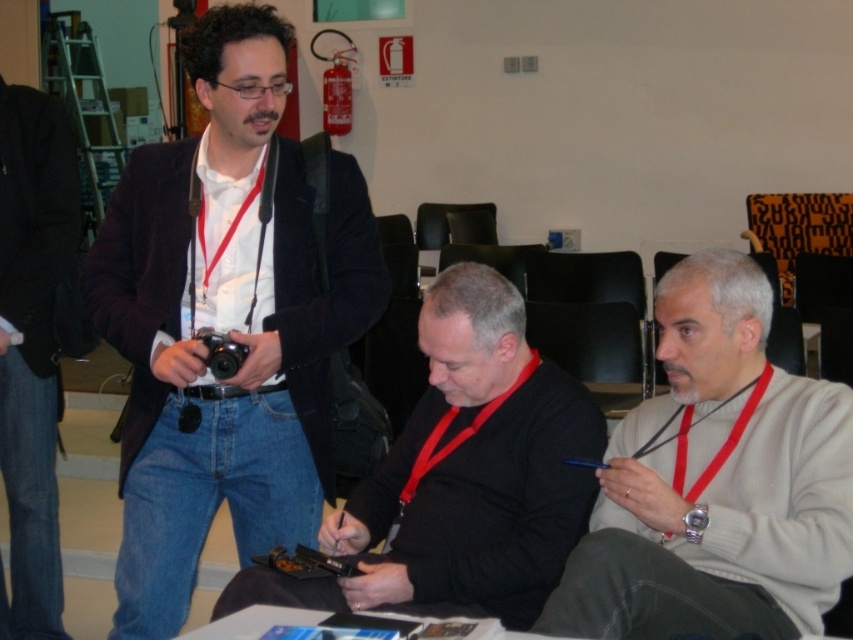
Consider the image. You are attending a conference and notice two individuals wearing sweaters. The first is wearing a gray wool sweater at right, and the second has a black matte sweater at center. From your perspective, which sweater is closer to you?

The gray wool sweater at right is closer to you because it is in front of the black matte sweater at center.

In the scene described, there is a black leather jacket at left. Where exactly is it located in terms of coordinates?

The black leather jacket at left is located at coordinates point (32, 346).